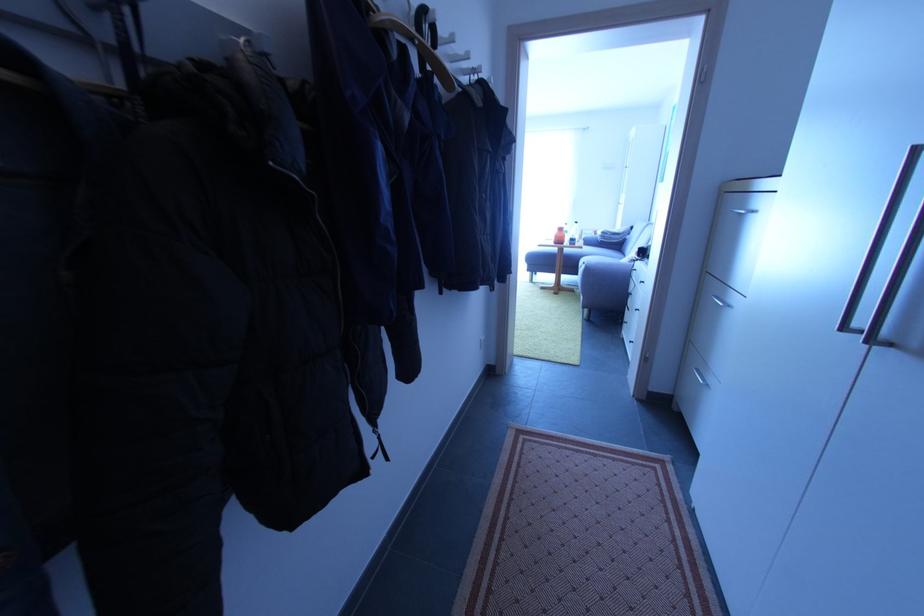
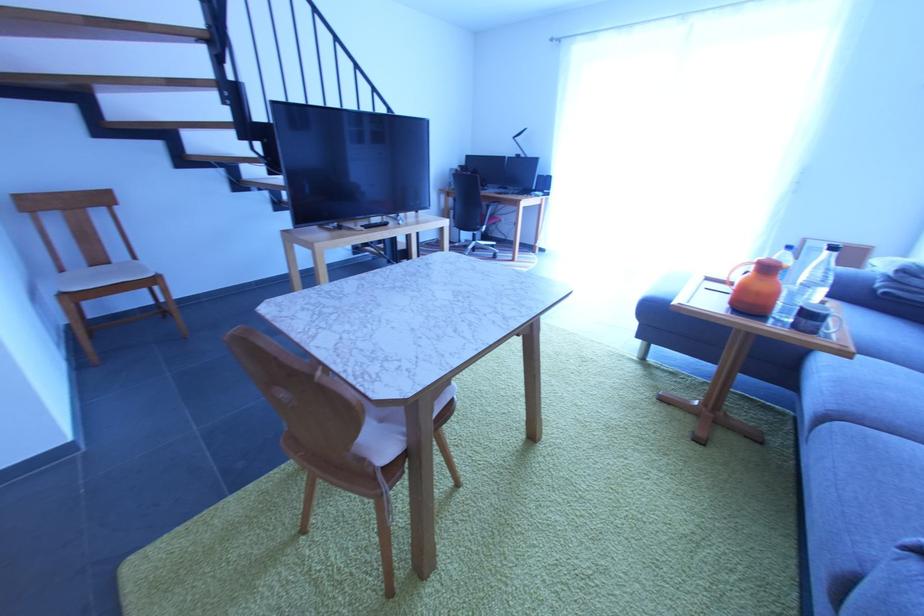
Find the pixel in the second image that matches point 578,246 in the first image.

(819, 334)